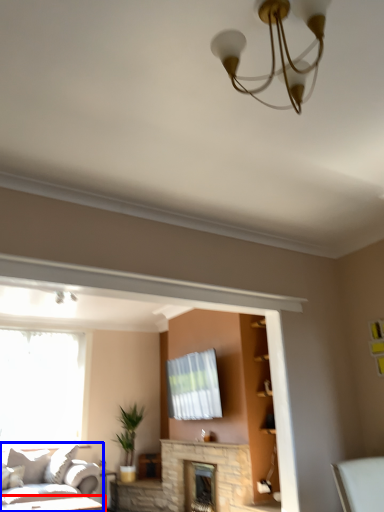
Question: Among these objects, which one is farthest to the camera, table (highlighted by a red box) or studio couch (highlighted by a blue box)?

Choices:
 (A) table
 (B) studio couch

Answer: (A)